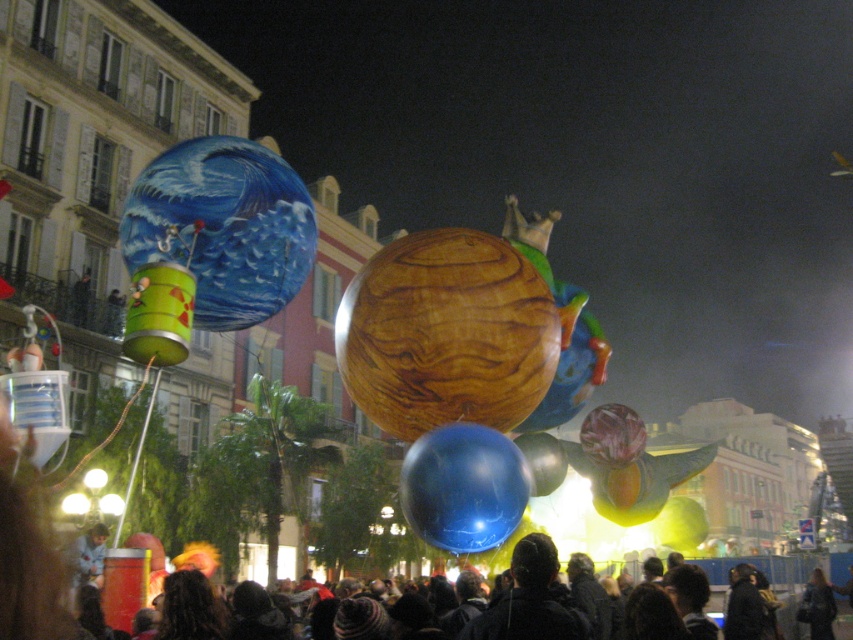
You are a photographer trying to capture the festive parade float. You notice two balloons, the shiny metallic balloon at upper left and the glossy blue balloon at center. Which balloon should you focus on if you want to include both in your shot but prioritize the taller one?

You should focus on the shiny metallic balloon at upper left because it is taller than the glossy blue balloon at center, so prioritizing it ensures both can be captured while emphasizing the taller balloon.

You are a photographer trying to capture the festive parade scene. You want to ensure that both the shiny metallic balloon at upper left and the glossy blue balloon at center are clearly visible in your photo. Based on their positions, which balloon should you focus on first to ensure both are in frame?

The shiny metallic balloon at upper left is positioned over the glossy blue balloon at center, so focusing on the shiny metallic balloon at upper left first will ensure both are in frame as the glossy blue balloon at center is beneath it.

You are a photographer at the parade. You want to take a photo of the wooden sphere at center and the dark hair at lower center. Which object should you focus on first if you want to capture both in the same frame without moving the camera?

The wooden sphere at center is located above dark hair at lower center, so you should focus on the wooden sphere at center first since it is closer to the camera.